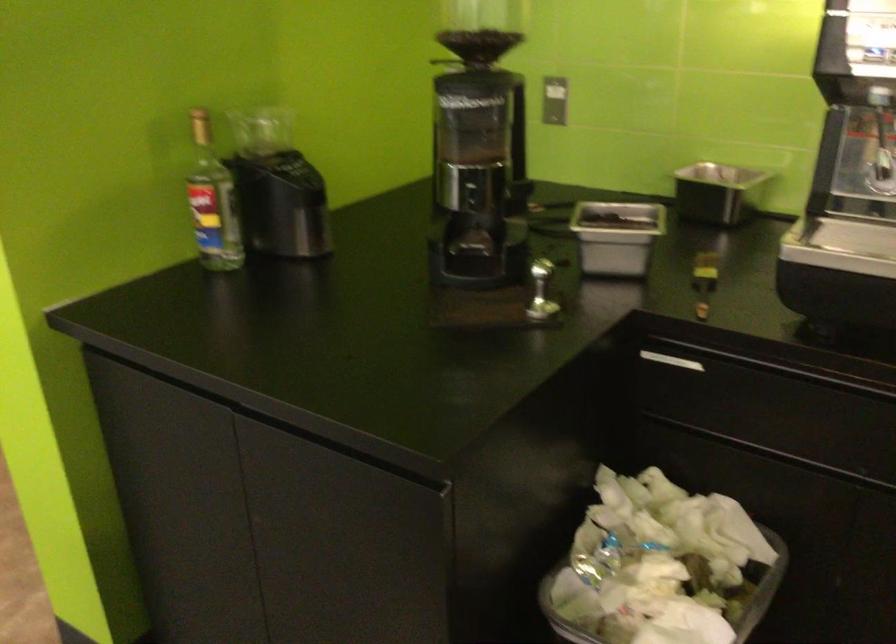
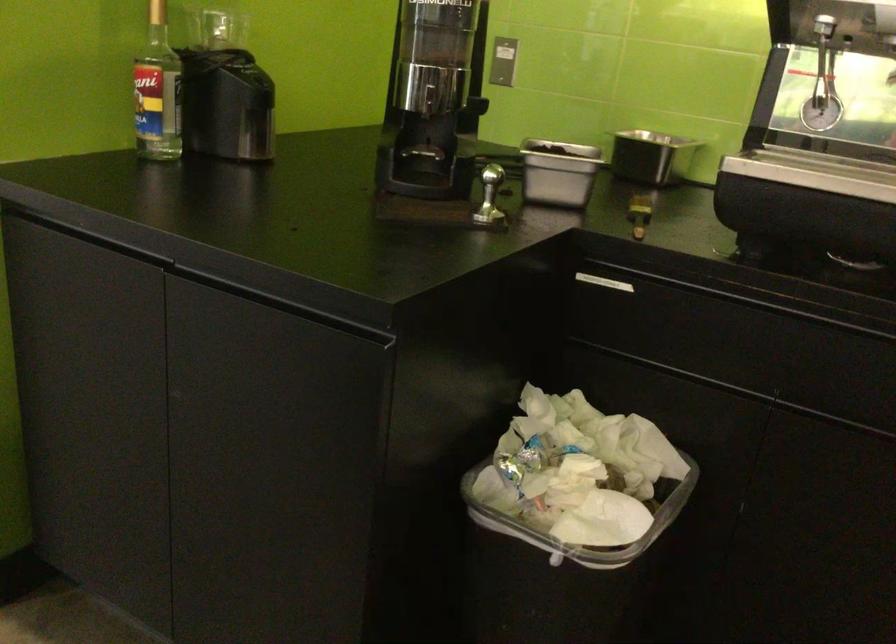
In the second image, find the point that corresponds to pixel 613 247 in the first image.

(558, 172)